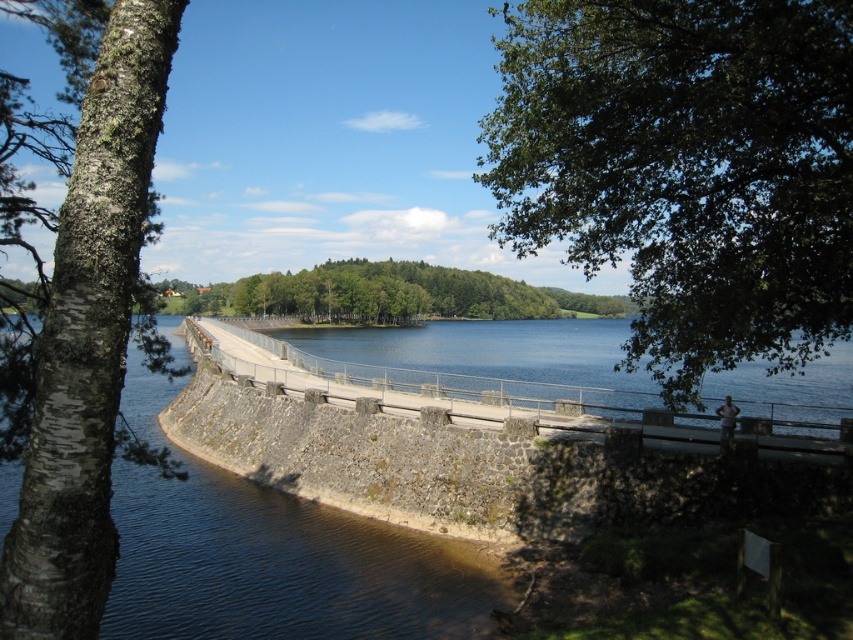
You are a hiker who wants to know which object is taller between the barky white tree at left and the smooth concrete bridge at center. Based on the scene, can you tell me which one is taller?

The smooth concrete bridge at center is taller than the barky white tree at left.

Based on the photo, you are a hiker standing on the smooth concrete bridge at center and want to reach the green leafy tree at center. Which direction should you walk to get there?

The smooth concrete bridge at center is positioned on the right side of the green leafy tree at center, so you should walk to the left to reach the green leafy tree at center.